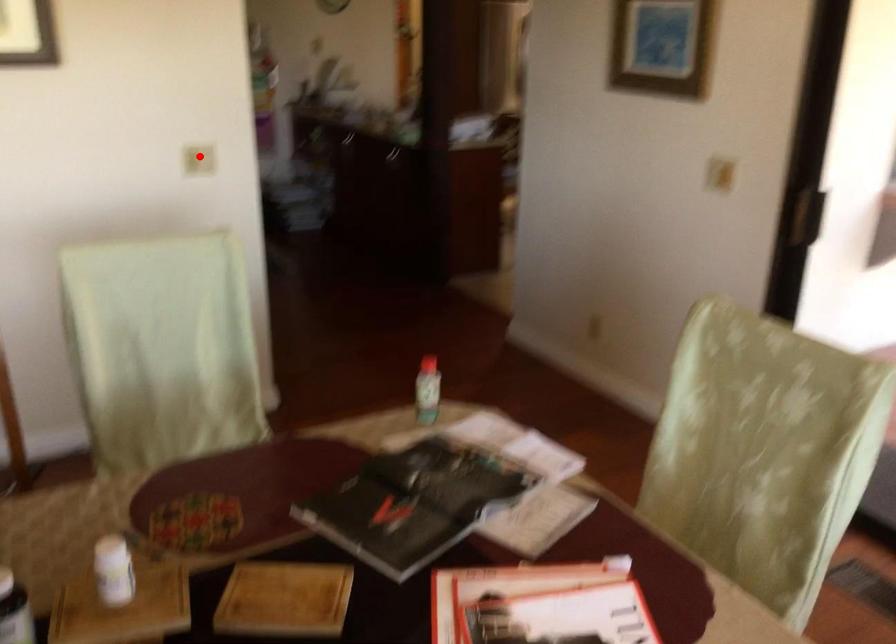
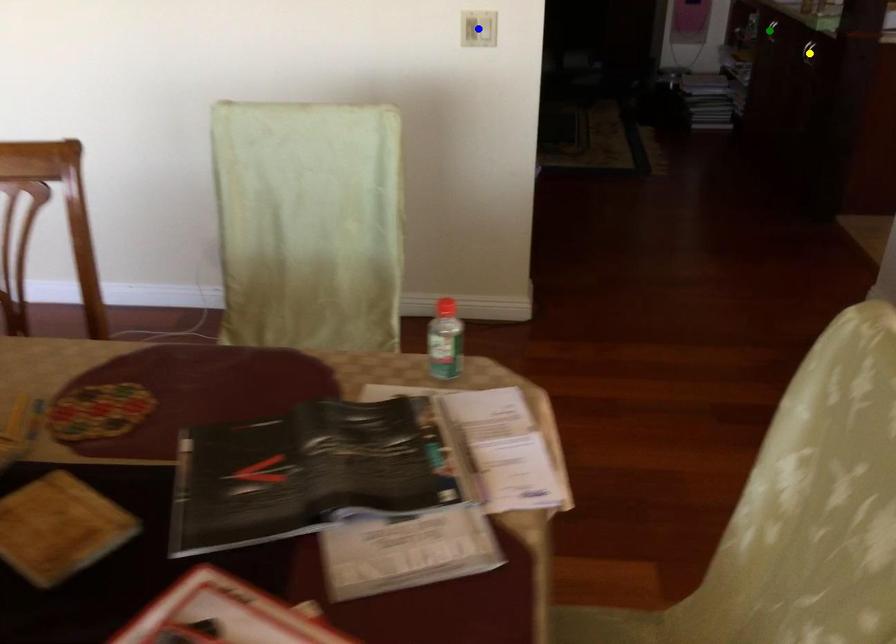
Question: I am providing you with two images of the same scene from different viewpoints. A red point is marked on the first image. You are given multiple points on the second image. Which point in image 2 is actually the same real-world point as the red point in image 1?

Choices:
 (A) green point
 (B) blue point
 (C) yellow point

Answer: (B)